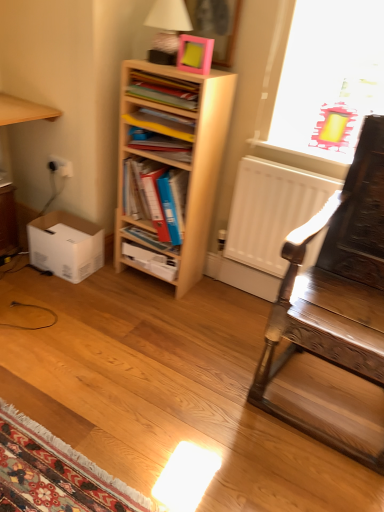
Question: Is light wood bookshelf at center at the right side of blue plastic folder at center, the 3th book viewed from the top?

Choices:
 (A) yes
 (B) no

Answer: (A)

Question: From a real-world perspective, does light wood bookshelf at center stand above blue plastic folder at center, the 3th book viewed from the top?

Choices:
 (A) no
 (B) yes

Answer: (B)

Question: Considering the relative sizes of light wood bookshelf at center and blue plastic folder at center, which ranks as the third book in bottom-to-top order, in the image provided, is light wood bookshelf at center shorter than blue plastic folder at center, which ranks as the third book in bottom-to-top order,?

Choices:
 (A) yes
 (B) no

Answer: (B)

Question: Is light wood bookshelf at center bigger than blue plastic folder at center, which ranks as the third book in bottom-to-top order?

Choices:
 (A) yes
 (B) no

Answer: (A)

Question: From the image's perspective, is light wood bookshelf at center on blue plastic folder at center, the 3th book viewed from the top?

Choices:
 (A) yes
 (B) no

Answer: (A)

Question: Considering the relative sizes of light wood bookshelf at center and blue plastic folder at center, the 3th book viewed from the top, in the image provided, is light wood bookshelf at center wider than blue plastic folder at center, the 3th book viewed from the top,?

Choices:
 (A) yes
 (B) no

Answer: (B)

Question: Can you confirm if matte white table lamp at upper center is smaller than white cardboard box at lower left?

Choices:
 (A) no
 (B) yes

Answer: (B)

Question: From a real-world perspective, does matte white table lamp at upper center sit lower than white cardboard box at lower left?

Choices:
 (A) yes
 (B) no

Answer: (B)

Question: Is matte white table lamp at upper center taller than white cardboard box at lower left?

Choices:
 (A) no
 (B) yes

Answer: (B)

Question: Is white cardboard box at lower left at the back of matte white table lamp at upper center?

Choices:
 (A) yes
 (B) no

Answer: (B)

Question: From the image's perspective, is matte white table lamp at upper center on top of white cardboard box at lower left?

Choices:
 (A) no
 (B) yes

Answer: (B)

Question: Is matte white table lamp at upper center facing towards white cardboard box at lower left?

Choices:
 (A) yes
 (B) no

Answer: (B)

Question: Is white cardboard box at lower left a part of pink matte picture frame at upper center?

Choices:
 (A) no
 (B) yes

Answer: (A)